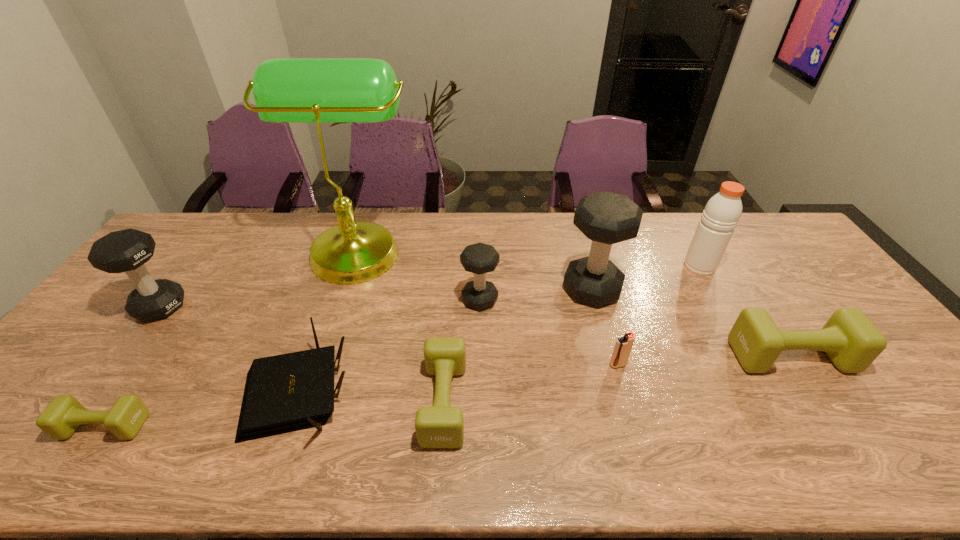
Where is `the rightmost dumbbell`? This screenshot has height=540, width=960. the rightmost dumbbell is located at coordinates (852, 342).

What are the coordinates of `black router` in the screenshot? It's located at click(x=284, y=393).

The width and height of the screenshot is (960, 540). I want to click on red igniter, so click(623, 346).

Locate an element on the screen. the second biggest olive dumbbell is located at coordinates (441, 425).

Find the location of a particular element. This screenshot has width=960, height=540. the second olive dumbbell from left to right is located at coordinates (441, 425).

This screenshot has height=540, width=960. Identify the location of the leftmost olive dumbbell. (61, 418).

I want to click on the shortest dumbbell, so click(x=61, y=418).

This screenshot has height=540, width=960. What are the coordinates of `blank space located 0.250m on the desk next to the tallest object` in the screenshot? It's located at (492, 248).

Identify the location of blank space located 0.360m on the left of the tallest dumbbell. (444, 289).

At what (x,y) coordinates should I click in order to perform the action: click on vacant space situated on the front of the orange shaker. Please return your answer as a coordinate pair (x, y). Looking at the image, I should click on (740, 337).